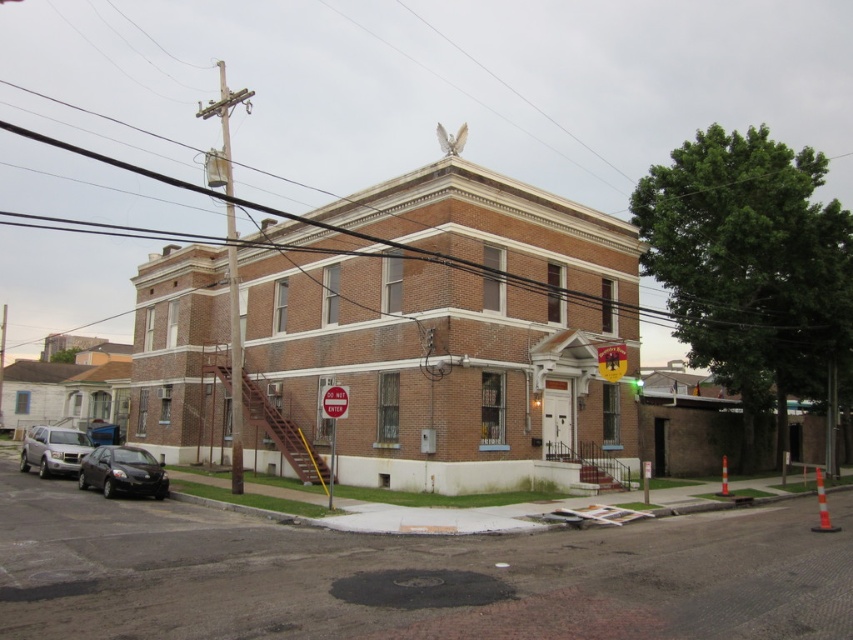
You are a pedestrian standing at the corner of the street where the two story brick building is located. You see a matte black car at lower left and a green glass traffic light at upper center. Which object is positioned higher from the ground?

The green glass traffic light at upper center is positioned higher from the ground than the matte black car at lower left.

You are a delivery person trying to park your van in the parking spot next to the two cars at the lower left. The van is 6 meters long. Can you fit your van between the matte black car at lower left and the satin silver suv at lower left?

The matte black car at lower left is smaller than the satin silver suv at lower left. Since the van is 6 meters long, the space between the two cars must be at least 6 meters. However, without knowing the exact distance between them, it is impossible to determine if the van will fit.